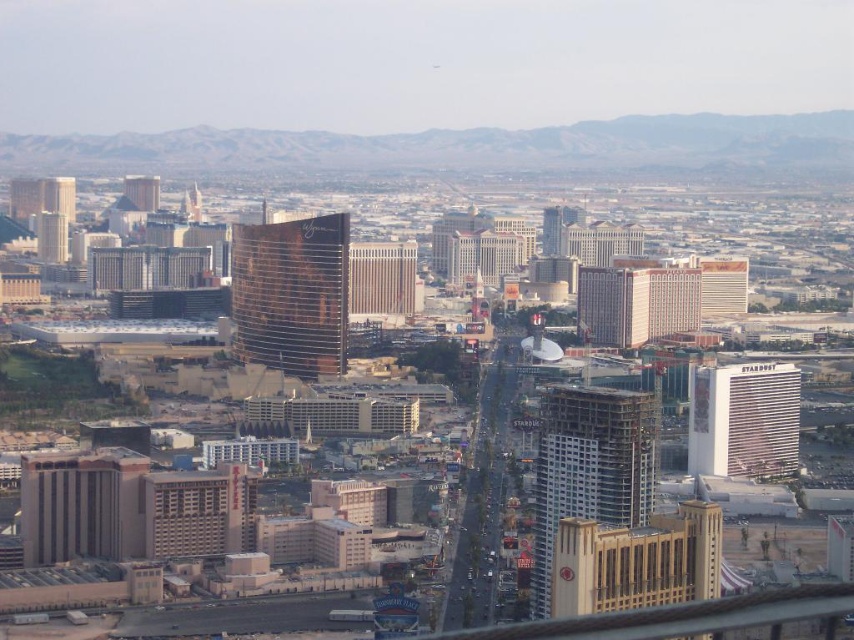
Question: Which point appears farthest from the camera in this image?

Choices:
 (A) (148, 483)
 (B) (235, 355)
 (C) (113, 490)
 (D) (39, 236)

Answer: (D)

Question: Which of these objects is positioned farthest from the matte gold hotel at center-left?

Choices:
 (A) rusty metal tower at center
 (B) brown textured building at center
 (C) beige concrete hotel at lower left
 (D) white glossy hotel at center-right

Answer: (D)

Question: Is rusty metal tower at center smaller than matte brown skyscraper at left?

Choices:
 (A) yes
 (B) no

Answer: (B)

Question: Based on their relative distances, which object is farther from the beige concrete hotel at lower left?

Choices:
 (A) matte brown skyscraper at left
 (B) beige concrete building at lower left
 (C) rusty metal tower at center

Answer: (A)

Question: Is white glossy hotel at right to the left of brown textured building at center from the viewer's perspective?

Choices:
 (A) no
 (B) yes

Answer: (A)

Question: Observing the image, what is the correct spatial positioning of gold metallic hotel at center in reference to matte gold hotel at center-left?

Choices:
 (A) right
 (B) left

Answer: (A)